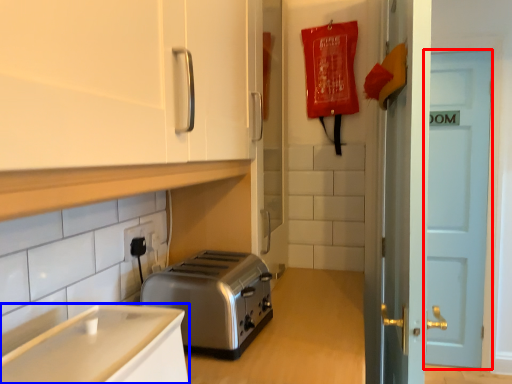
Question: Which point is further to the camera, door (highlighted by a red box) or cabinetry (highlighted by a blue box)?

Choices:
 (A) door
 (B) cabinetry

Answer: (A)